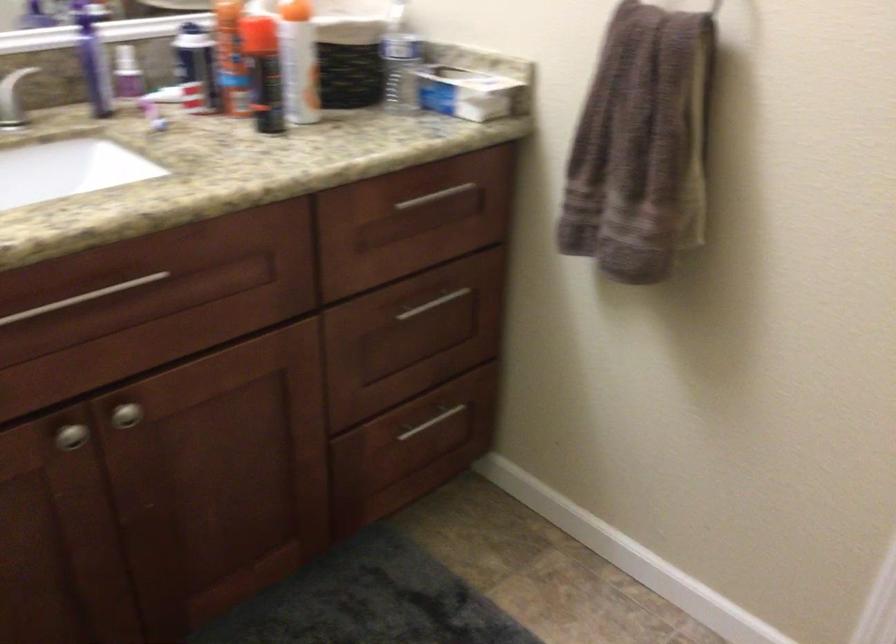
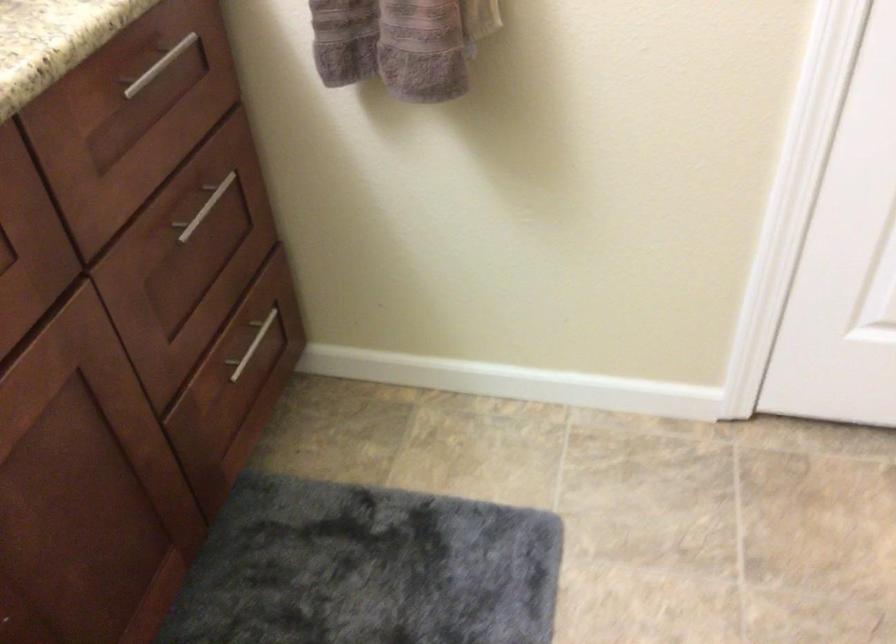
In the second image, find the point that corresponds to (x=433, y=194) in the first image.

(159, 66)